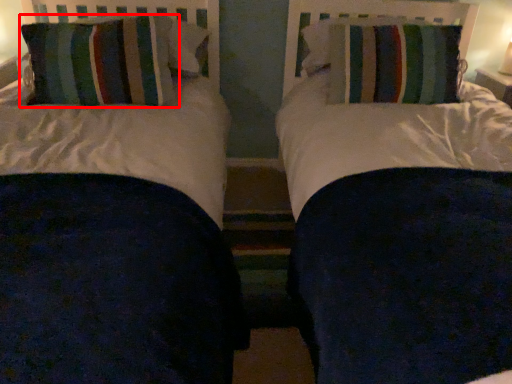
Question: Considering the relative positions of pillow (annotated by the red box) and pillow in the image provided, where is pillow (annotated by the red box) located with respect to the staircase?

Choices:
 (A) right
 (B) left

Answer: (B)